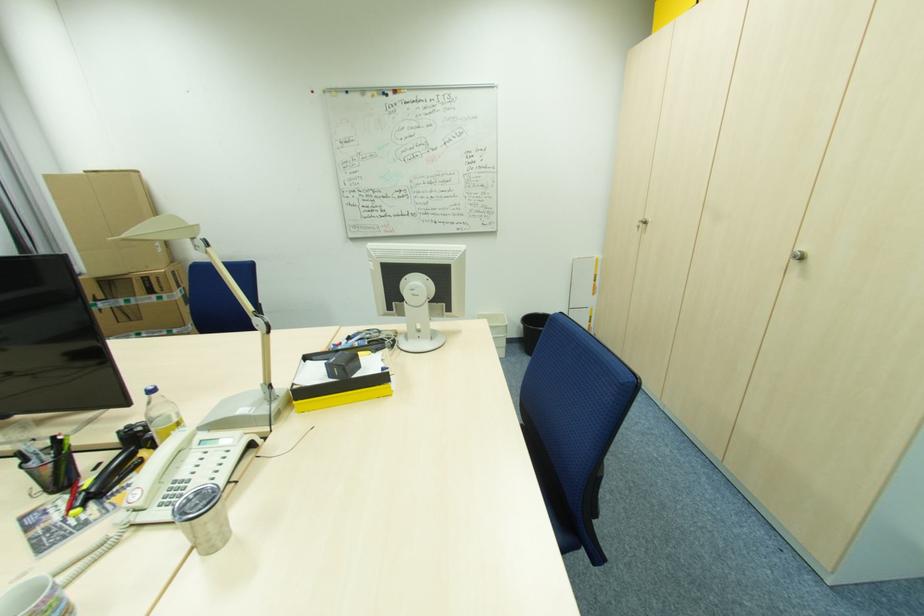
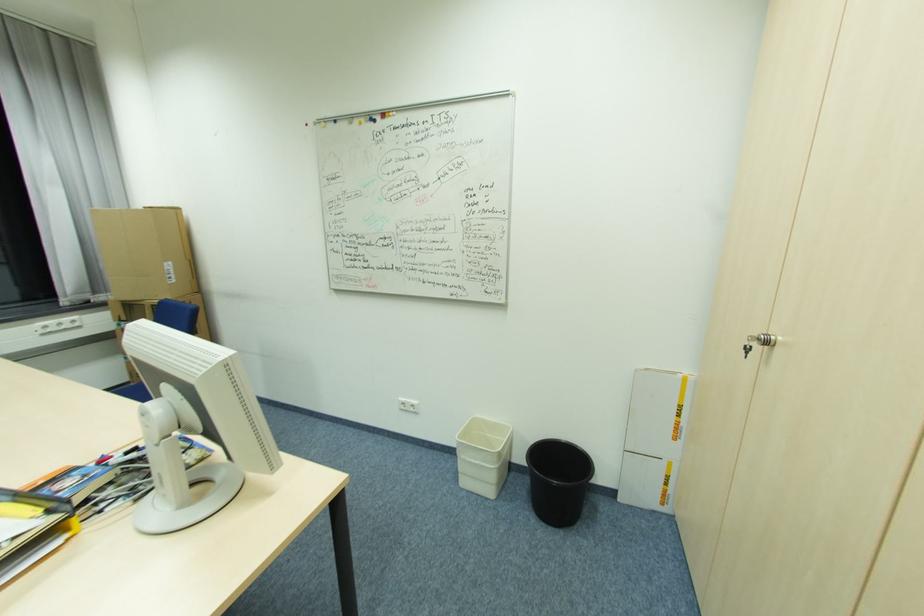
Locate, in the second image, the point that corresponds to point 103,298 in the first image.

(127, 318)